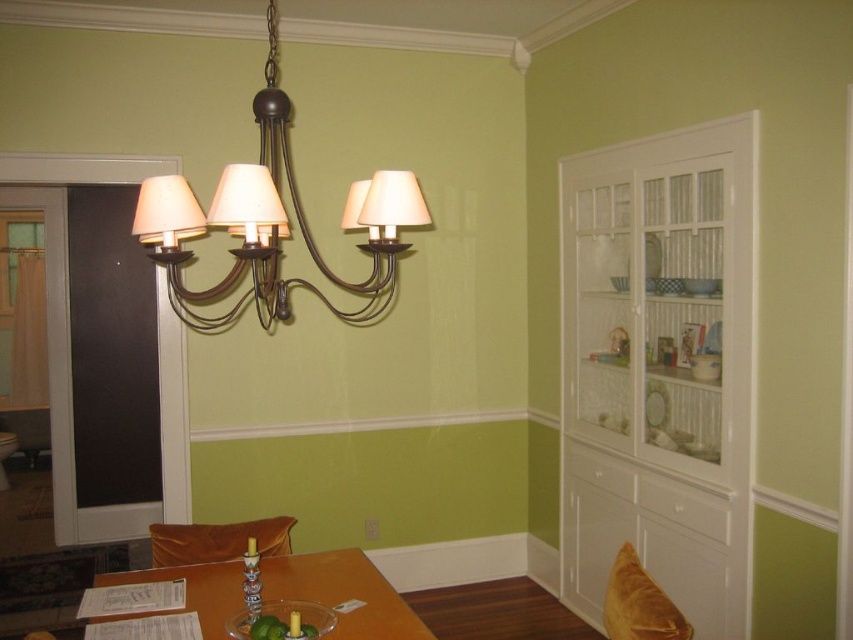
Question: Observing the image, what is the correct spatial positioning of wooden table at center in reference to clear glass bowl at lower center?

Choices:
 (A) below
 (B) above

Answer: (A)

Question: Does velvet yellow pillow at lower right have a larger size compared to clear glass bowl at lower center?

Choices:
 (A) yes
 (B) no

Answer: (A)

Question: Which object is farther from the camera taking this photo?

Choices:
 (A) wooden table at center
 (B) matte bronze chandelier at upper center
 (C) clear glass bowl at lower center
 (D) velvet yellow pillow at lower right

Answer: (A)

Question: Does matte bronze chandelier at upper center appear over wooden table at center?

Choices:
 (A) yes
 (B) no

Answer: (A)

Question: Which of these objects is positioned farthest from the clear glass bowl at lower center?

Choices:
 (A) wooden table at center
 (B) velvet yellow pillow at lower right

Answer: (B)

Question: Estimate the real-world distances between objects in this image. Which object is farther from the matte bronze chandelier at upper center?

Choices:
 (A) wooden table at center
 (B) velvet orange chair at lower center

Answer: (B)